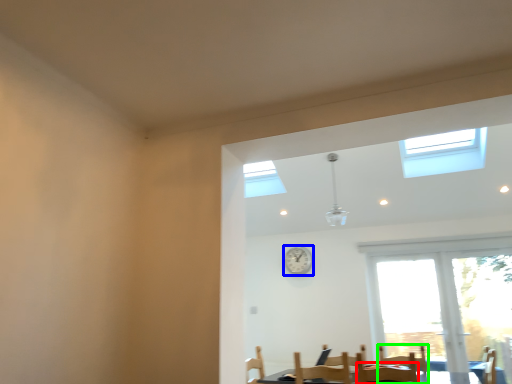
Question: Based on their relative distances, which object is farther from chair (highlighted by a red box)? Choose from clock (highlighted by a blue box) and armchair (highlighted by a green box).

Choices:
 (A) clock
 (B) armchair

Answer: (A)